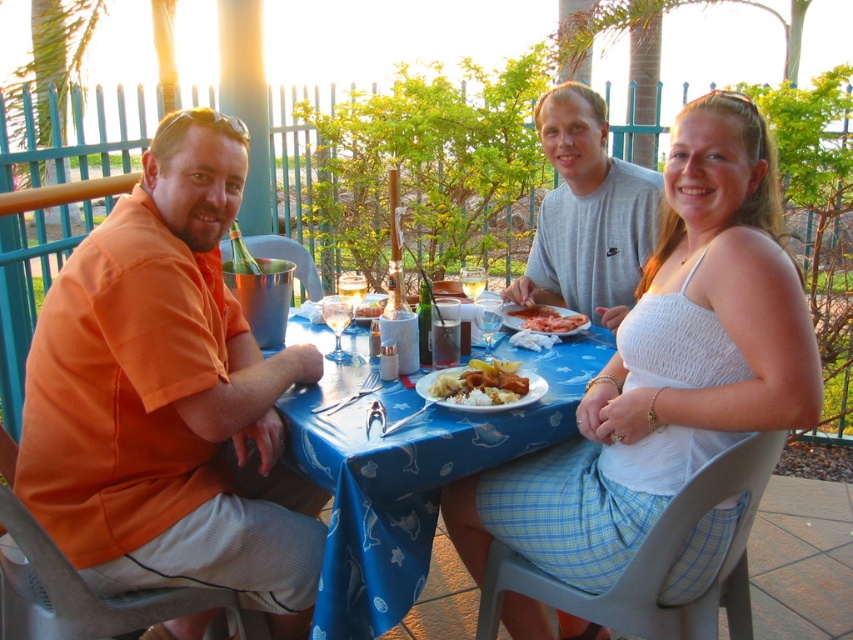
Question: Which point is closer to the camera?

Choices:
 (A) (186, 632)
 (B) (540, 317)
 (C) (689, 589)

Answer: (C)

Question: Does orange cotton shirt at left appear on the right side of golden brown bread at center?

Choices:
 (A) no
 (B) yes

Answer: (A)

Question: Does blue fabric table at center come behind shiny pink meat at center?

Choices:
 (A) no
 (B) yes

Answer: (A)

Question: Estimate the real-world distances between objects in this image. Which object is closer to the white textured tank top at center?

Choices:
 (A) golden brown bread at center
 (B) orange cotton shirt at left
 (C) blue fabric table at center

Answer: (C)

Question: Among these objects, which one is farthest from the camera?

Choices:
 (A) shiny pink meat at center
 (B) blue fabric table at center
 (C) gray cotton shirt at center
 (D) golden brown bread at center

Answer: (C)

Question: Is white textured tank top at center thinner than shiny pink meat at center?

Choices:
 (A) no
 (B) yes

Answer: (A)